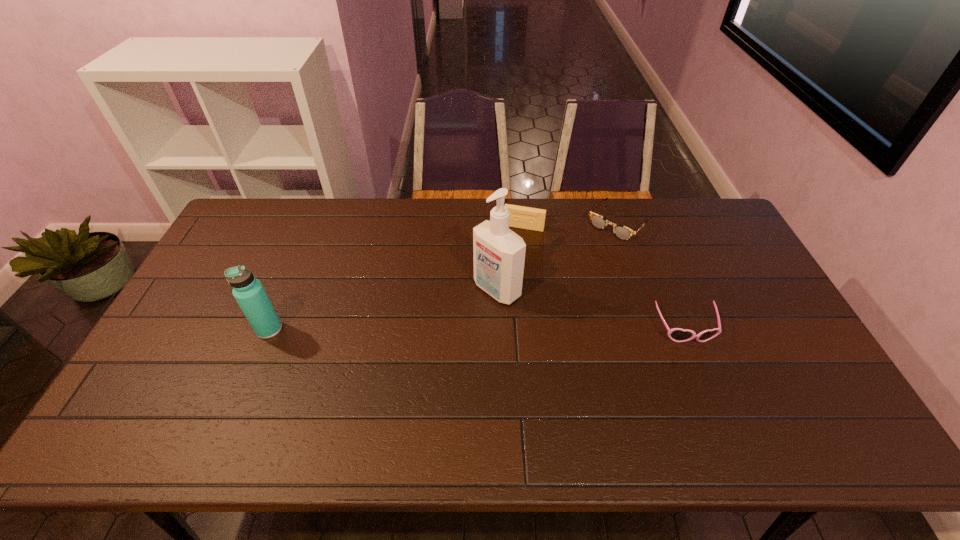
The height and width of the screenshot is (540, 960). What are the coordinates of `free location located 0.240m at the front of the videotape with spools` in the screenshot? It's located at (505, 280).

Find the location of a particular element. vacant position located at the front of the videotape with spools is located at coordinates (497, 303).

I want to click on vacant space positioned on the frame of the spectacles, so click(575, 267).

At what (x,y) coordinates should I click in order to perform the action: click on free space located on the frame of the spectacles. Please return your answer as a coordinate pair (x, y). Looking at the image, I should click on (570, 273).

Locate an element on the screen. vacant area situated 0.250m on the frame of the spectacles is located at coordinates (564, 280).

Where is `vacant area situated on the front label of the cleansing agent`? This screenshot has height=540, width=960. vacant area situated on the front label of the cleansing agent is located at coordinates (466, 313).

Identify the location of vacant area situated 0.400m on the front label of the cleansing agent. This screenshot has height=540, width=960. (369, 385).

Locate an element on the screen. Image resolution: width=960 pixels, height=540 pixels. blank area located on the front label of the cleansing agent is located at coordinates (437, 334).

Find the location of `videotape present at the far edge`. videotape present at the far edge is located at coordinates (523, 217).

The image size is (960, 540). I want to click on spectacles at the far edge, so click(621, 232).